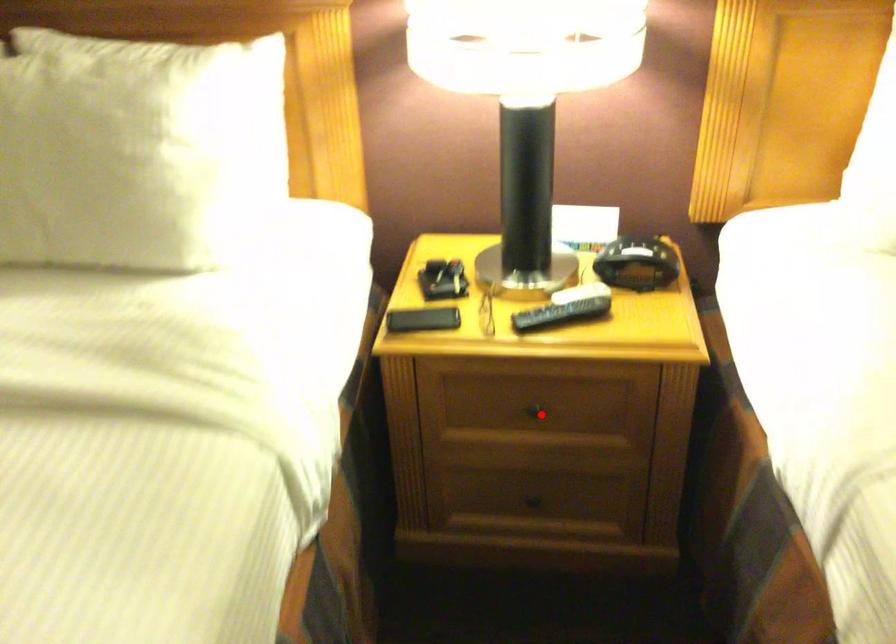
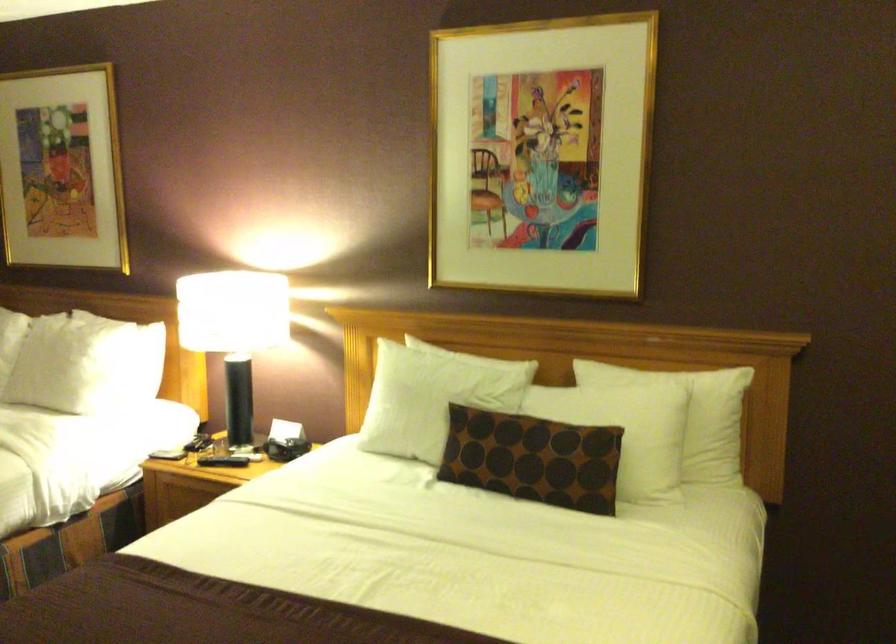
Question: I am providing you with two images of the same scene from different viewpoints. A red point is marked on the first image. Is the red point's position out of view in image 2?

Choices:
 (A) Yes
 (B) No

Answer: (A)